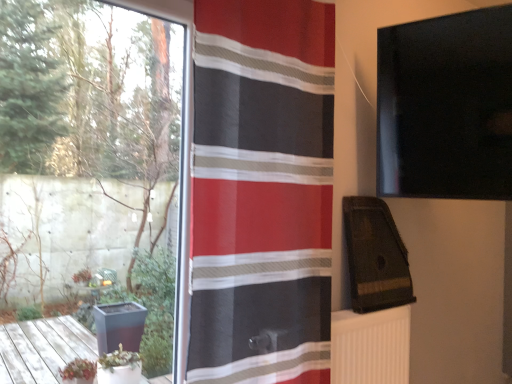
Question: Is white ribbed radiator at lower right situated inside red striped fabric at center or outside?

Choices:
 (A) inside
 (B) outside

Answer: (B)

Question: Based on their sizes in the image, would you say white ribbed radiator at lower right is bigger or smaller than red striped fabric at center?

Choices:
 (A) big
 (B) small

Answer: (B)

Question: Estimate the real-world distances between objects in this image. Which object is farther from the red striped fabric at center?

Choices:
 (A) white ribbed radiator at lower right
 (B) transparent glass window at left

Answer: (B)

Question: Based on their relative distances, which object is nearer to the transparent glass window at left?

Choices:
 (A) white ribbed radiator at lower right
 (B) red striped fabric at center

Answer: (B)